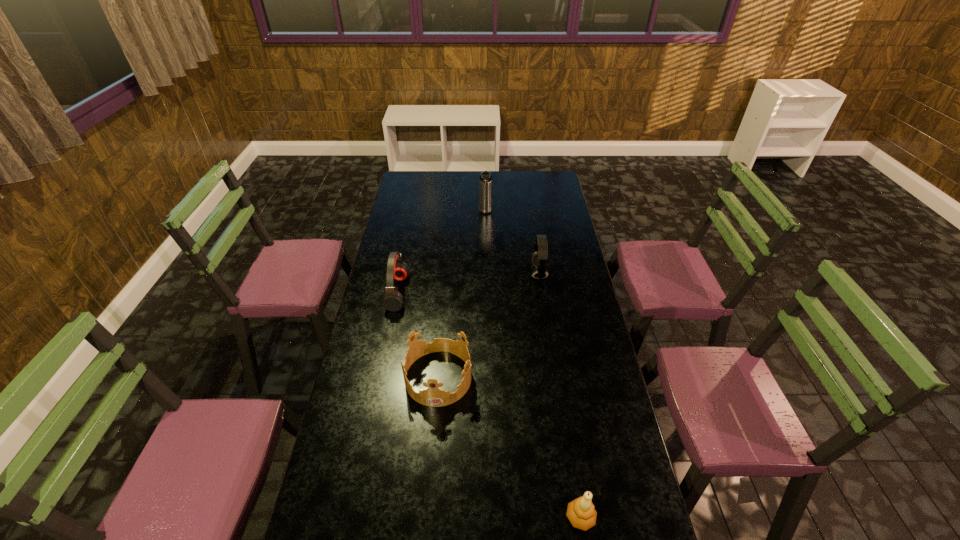
Locate an element on the screen. free space between the tallest object and the candle_holder is located at coordinates (533, 365).

Identify the location of free space between the leftmost object and the thermos bottle. This screenshot has height=540, width=960. (442, 253).

Where is `free spot between the second nearest object and the tallest object`? This screenshot has height=540, width=960. free spot between the second nearest object and the tallest object is located at coordinates (462, 295).

This screenshot has width=960, height=540. Identify the location of empty location between the right earphone and the fourth object from right to left. (489, 325).

At what (x,y) coordinates should I click in order to perform the action: click on vacant space that's between the second object from left to right and the thermos bottle. Please return your answer as a coordinate pair (x, y). Image resolution: width=960 pixels, height=540 pixels. Looking at the image, I should click on (462, 295).

Where is `blank region between the fourth farthest object and the candle_holder`? blank region between the fourth farthest object and the candle_holder is located at coordinates (510, 447).

This screenshot has height=540, width=960. Identify the location of object that stands as the second closest to the tallest object. (396, 269).

The width and height of the screenshot is (960, 540). I want to click on the fourth closest object relative to the tiara, so click(x=485, y=181).

Image resolution: width=960 pixels, height=540 pixels. What are the coordinates of `blank space that satisfies the following two spatial constraints: 1. on the ear cups of the leftmost object; 2. on the left side of the nearest object` in the screenshot? It's located at (352, 517).

The height and width of the screenshot is (540, 960). What are the coordinates of `vacant space that satisfies the following two spatial constraints: 1. on the front-facing side of the candle_holder; 2. on the left side of the fourth farthest object` in the screenshot? It's located at (426, 517).